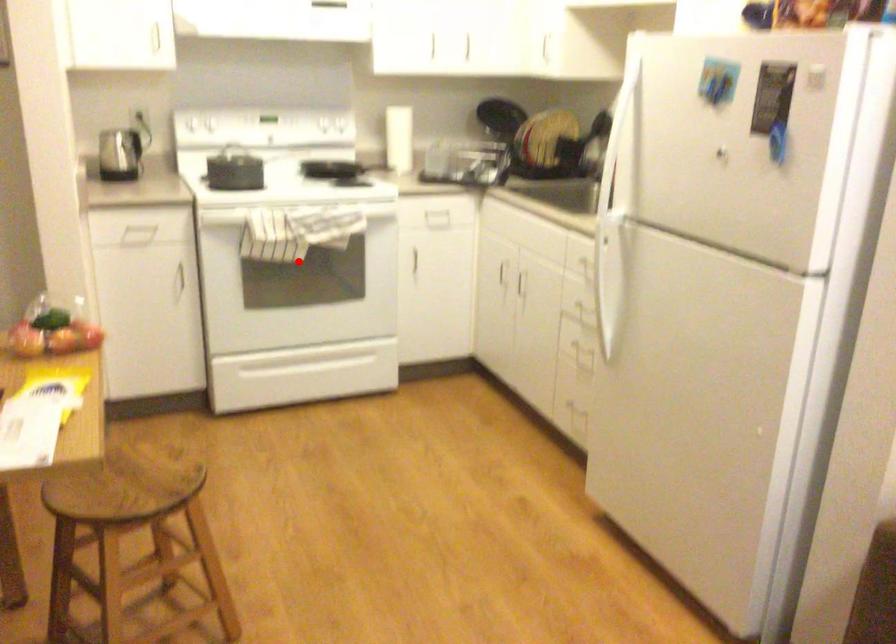
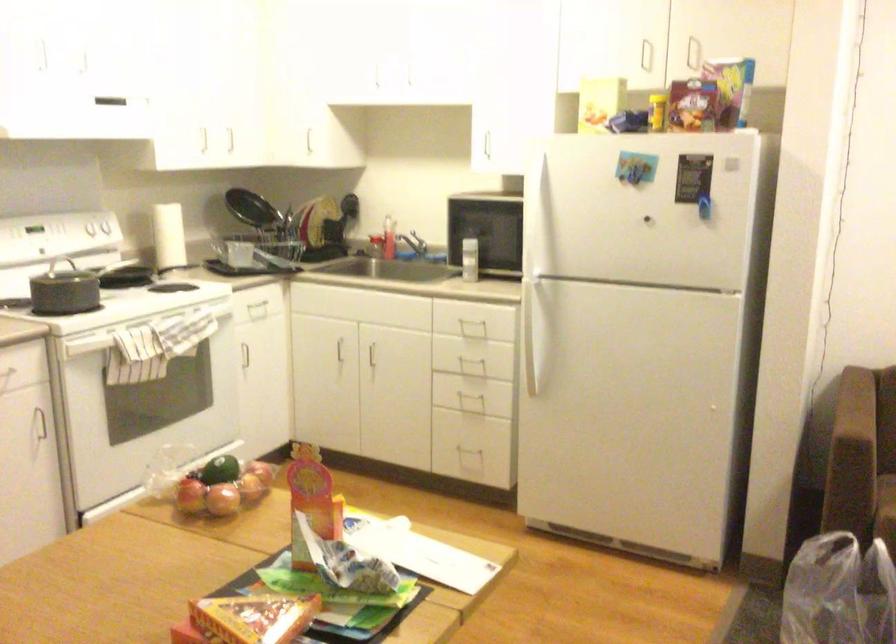
Find the pixel in the second image that matches the highlighted location in the first image.

(174, 382)